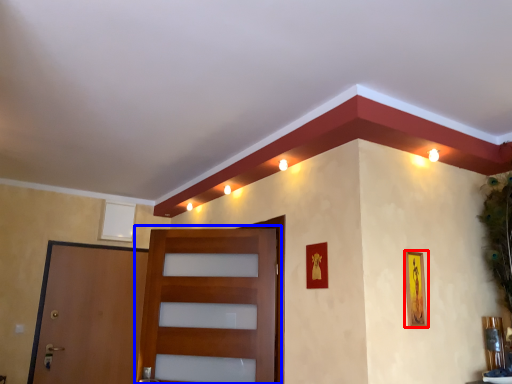
Question: Which of the following is the closest to the observer, picture frame (highlighted by a red box) or door (highlighted by a blue box)?

Choices:
 (A) picture frame
 (B) door

Answer: (A)